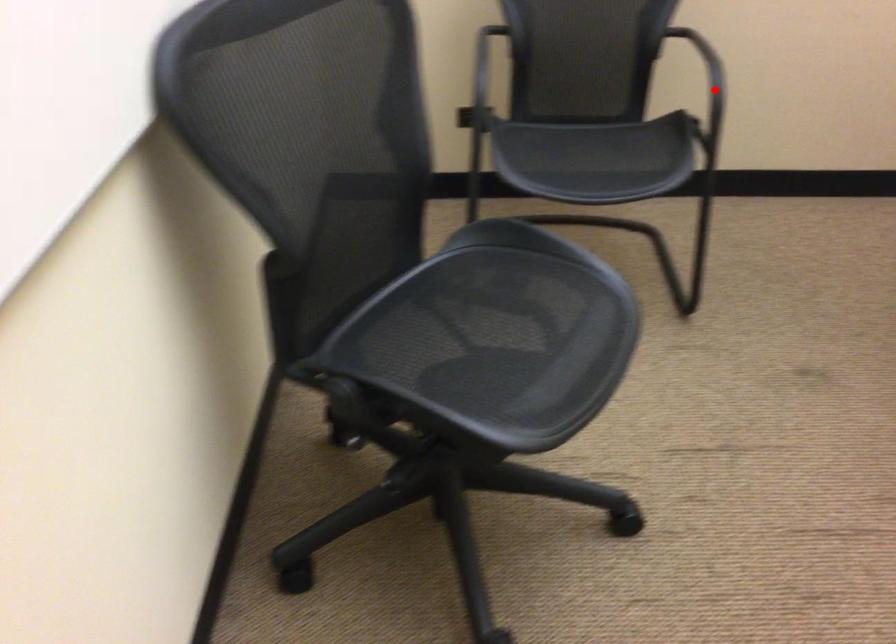
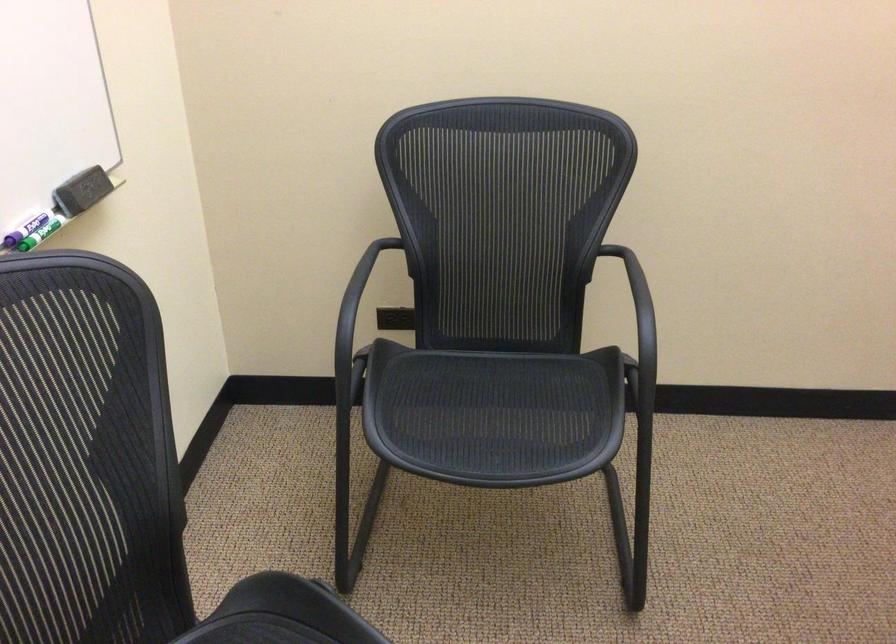
Where in the second image is the point corresponding to the highlighted location from the first image?

(639, 348)